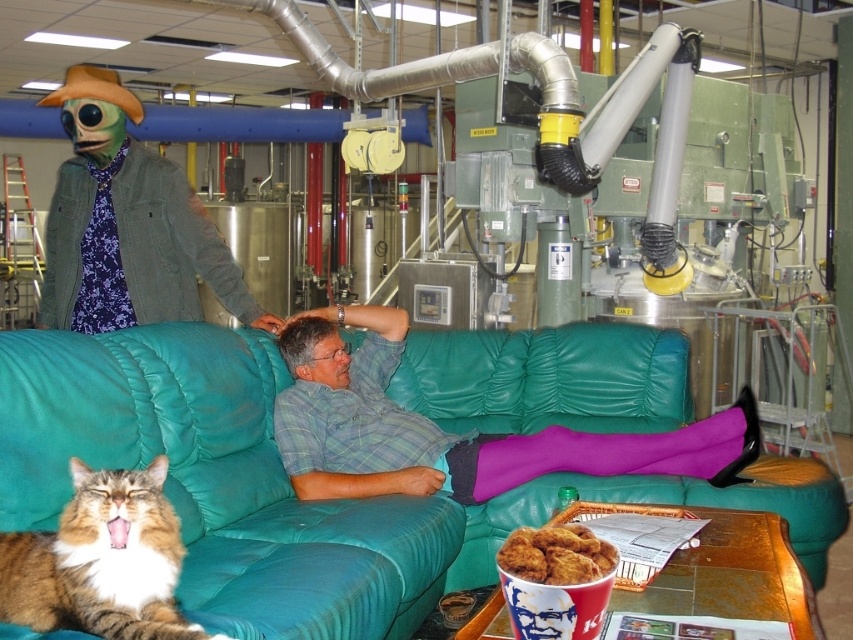
You are an observer in the scene. You notice the plaid shirt at center and the tabby fur cat at lower left. Which object is located to the right of the other?

The plaid shirt at center is positioned on the right side of tabby fur cat at lower left.

You are a delivery person who needs to place a large package on the teal leather couch at center. However, there is a tabby fur cat at lower left nearby. Considering their heights, can you place the package on the couch without disturbing the cat?

The teal leather couch at center is much taller than the tabby fur cat at lower left. Since the couch is taller, placing the package on it would not disturb the cat, which is lower to the ground.

You are an observer in the industrial setting described. You notice a plaid shirt at center and a tabby fur cat at lower left. Which object takes up more space in the image?

The plaid shirt at center is larger in size than the tabby fur cat at lower left, so it takes up more space in the image.